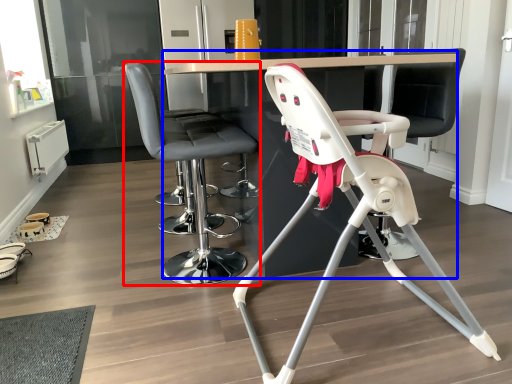
Question: Among these objects, which one is nearest to the camera, chair (highlighted by a red box) or table (highlighted by a blue box)?

Choices:
 (A) chair
 (B) table

Answer: (B)